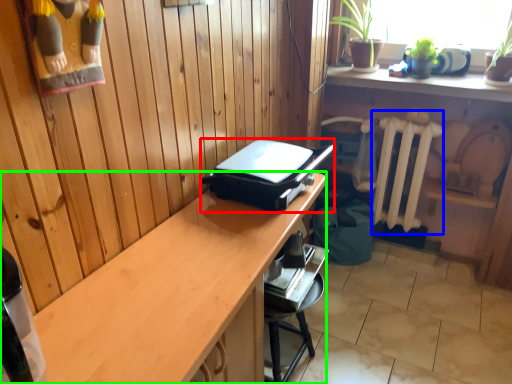
Question: Which object is positioned farthest from appliance (highlighted by a red box)? Select from radiator (highlighted by a blue box) and desk (highlighted by a green box).

Choices:
 (A) radiator
 (B) desk

Answer: (A)